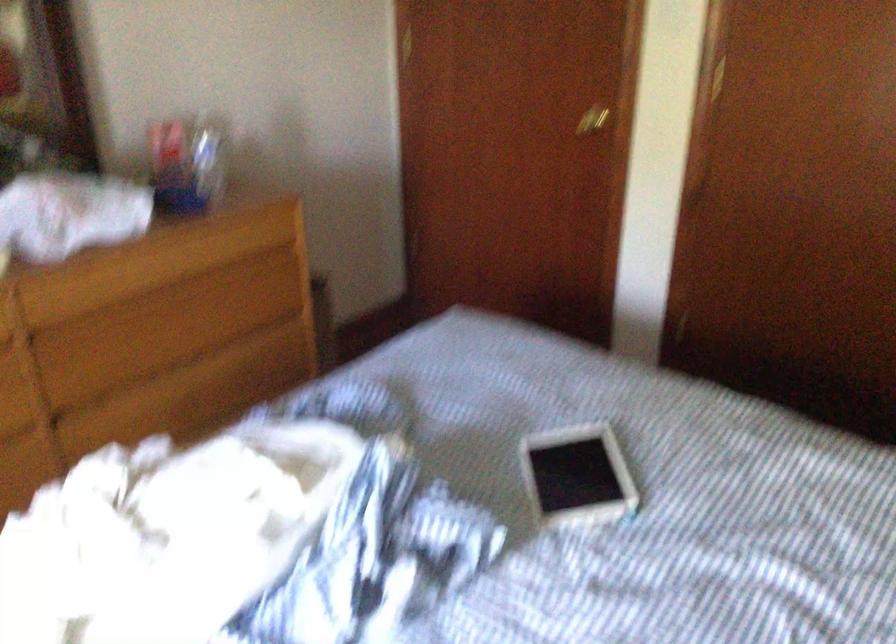
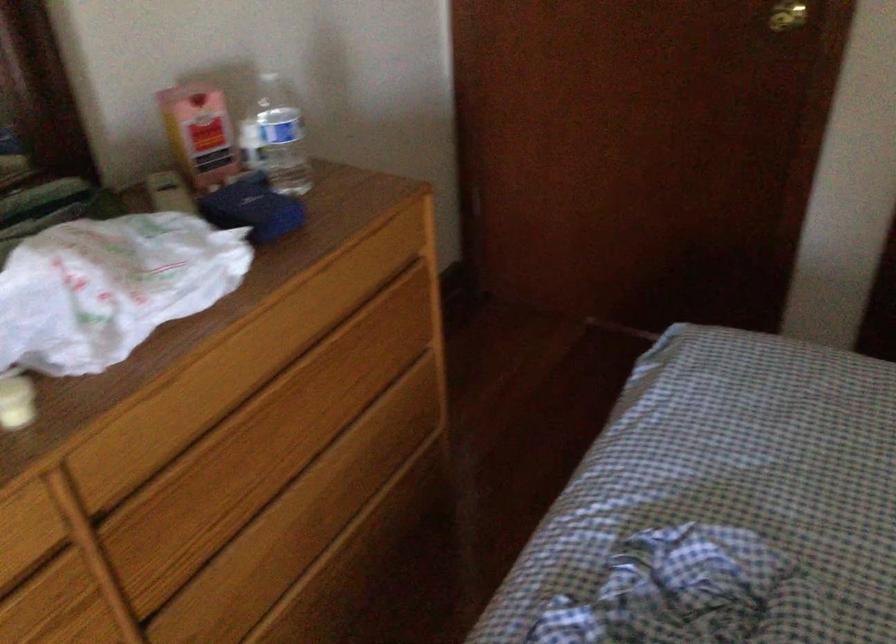
Where in the second image is the point corresponding to point (202, 156) from the first image?

(276, 138)